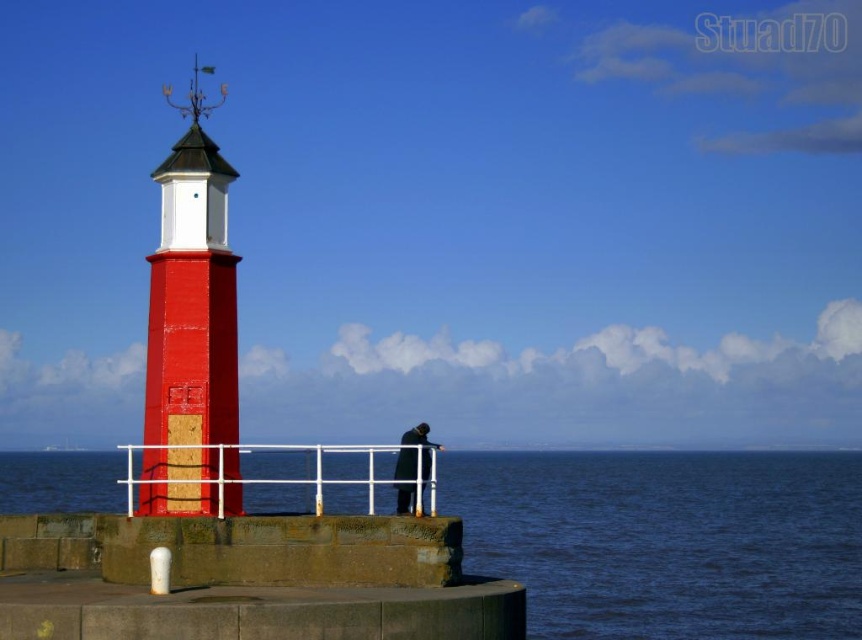
Is stone dock at center positioned in front of white metal/rail at center?

Yes, it is in front of white metal/rail at center.

Does point (261, 532) come in front of point (415, 465)?

Yes, it is in front of point (415, 465).

Find the location of a particular element. This screenshot has height=640, width=862. stone dock at center is located at coordinates (248, 579).

Describe the element at coordinates (248, 579) in the screenshot. I see `stone dock at center` at that location.

Does stone dock at center appear under dark gray coat at center?

Actually, stone dock at center is above dark gray coat at center.

Where is `stone dock at center`? stone dock at center is located at coordinates (248, 579).

Can you confirm if smooth concrete water at lower left is positioned to the left of stone dock at center?

No, smooth concrete water at lower left is not to the left of stone dock at center.

Does smooth concrete water at lower left lie in front of stone dock at center?

No, smooth concrete water at lower left is further to the viewer.

Locate an element on the screen. The width and height of the screenshot is (862, 640). smooth concrete water at lower left is located at coordinates (666, 540).